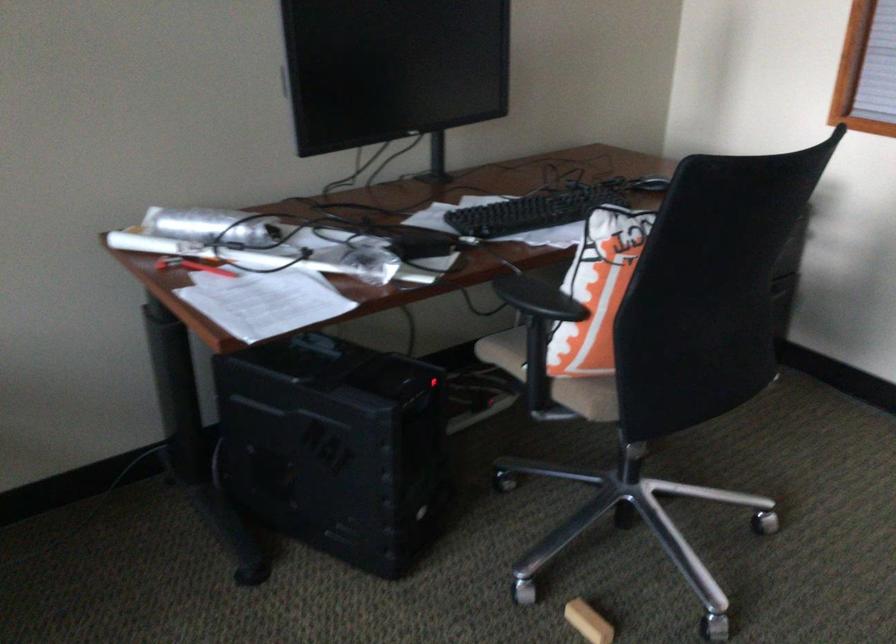
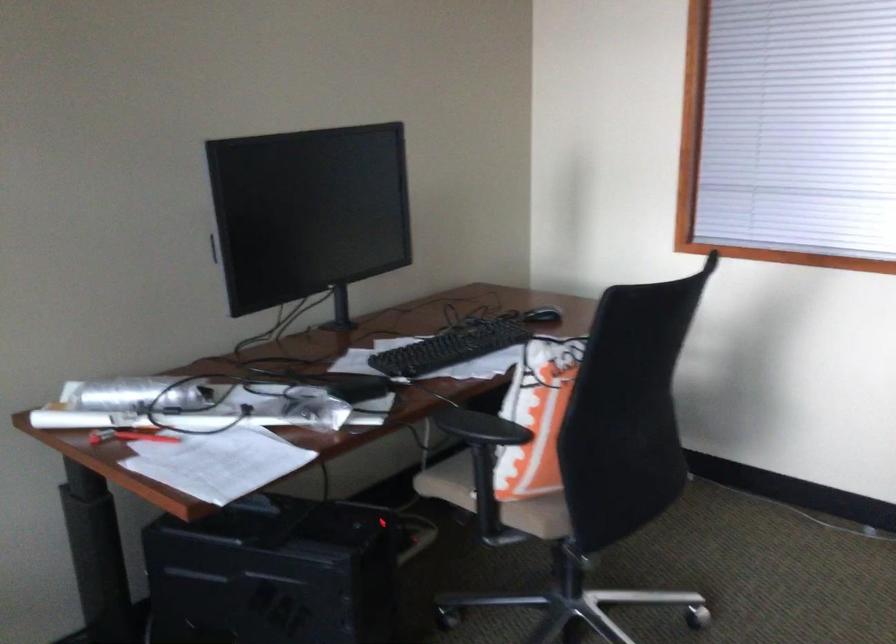
Question: In a continuous first-person perspective shot, in which direction is the camera moving?

Choices:
 (A) Left
 (B) Right
 (C) Forward
 (D) Backward

Answer: (A)